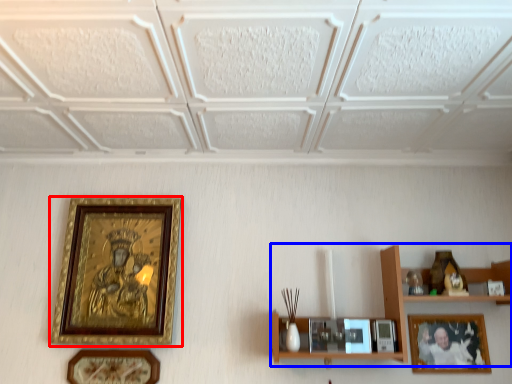
Question: Among these objects, which one is farthest to the camera, picture frame (highlighted by a red box) or shelf (highlighted by a blue box)?

Choices:
 (A) picture frame
 (B) shelf

Answer: (A)